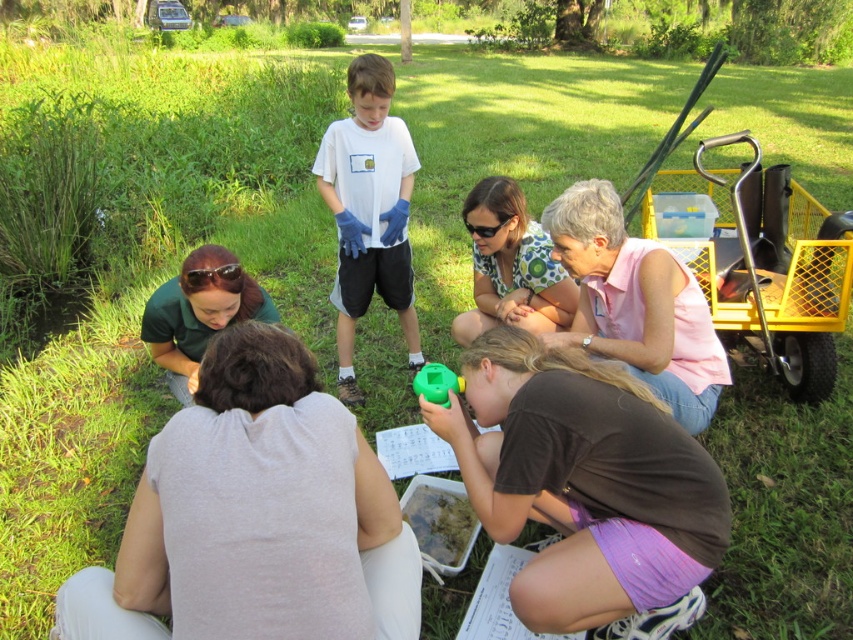
Question: Which of the following is the farthest from the observer?

Choices:
 (A) (509, 257)
 (B) (183, 340)

Answer: (A)

Question: Is white fabric at lower center to the left of pink fabric at center from the viewer's perspective?

Choices:
 (A) yes
 (B) no

Answer: (A)

Question: Considering the real-world distances, which object is farthest from the white fabric at lower center?

Choices:
 (A) pink fabric at center
 (B) white matte t-shirt at center
 (C) green matte plastic bottle at lower center

Answer: (B)

Question: Can you confirm if white fabric at lower center is smaller than green matte shirt at lower left?

Choices:
 (A) yes
 (B) no

Answer: (A)

Question: Which point is closer to the camera?

Choices:
 (A) pink fabric at center
 (B) green matte shirt at lower left

Answer: (B)

Question: Can you confirm if white fabric at lower center is positioned below pink fabric at center?

Choices:
 (A) yes
 (B) no

Answer: (A)